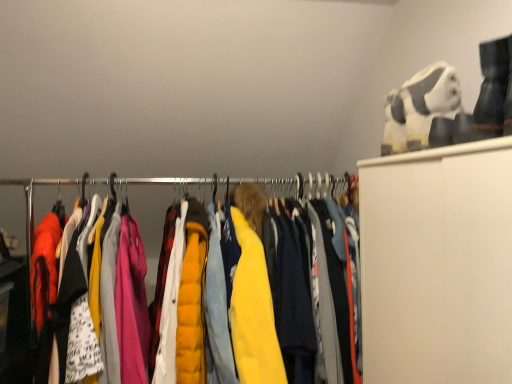
Question: Does white plush toy at upper right come behind yellow quilted jacket at center?

Choices:
 (A) no
 (B) yes

Answer: (B)

Question: Can you confirm if white plush toy at upper right is taller than yellow quilted jacket at center?

Choices:
 (A) no
 (B) yes

Answer: (A)

Question: Does white plush toy at upper right have a lesser height compared to yellow quilted jacket at center?

Choices:
 (A) yes
 (B) no

Answer: (A)

Question: Is white plush toy at upper right closer to camera compared to yellow quilted jacket at center?

Choices:
 (A) no
 (B) yes

Answer: (A)

Question: Considering the relative sizes of white plush toy at upper right and yellow quilted jacket at center in the image provided, is white plush toy at upper right bigger than yellow quilted jacket at center?

Choices:
 (A) no
 (B) yes

Answer: (A)

Question: Considering the positions of yellow quilted jacket at center and metallic hangers at center in the image, is yellow quilted jacket at center taller or shorter than metallic hangers at center?

Choices:
 (A) tall
 (B) short

Answer: (A)

Question: Looking at the image, does yellow quilted jacket at center seem bigger or smaller compared to metallic hangers at center?

Choices:
 (A) small
 (B) big

Answer: (B)

Question: From the image's perspective, is yellow quilted jacket at center positioned above or below metallic hangers at center?

Choices:
 (A) above
 (B) below

Answer: (B)

Question: Considering the positions of yellow quilted jacket at center and metallic hangers at center in the image, is yellow quilted jacket at center wider or thinner than metallic hangers at center?

Choices:
 (A) thin
 (B) wide

Answer: (B)

Question: Is point (237, 182) closer or farther from the camera than point (439, 102)?

Choices:
 (A) farther
 (B) closer

Answer: (A)

Question: Would you say metallic hangers at center is inside or outside white plush toy at upper right?

Choices:
 (A) inside
 (B) outside

Answer: (B)

Question: In terms of height, does metallic hangers at center look taller or shorter compared to white plush toy at upper right?

Choices:
 (A) short
 (B) tall

Answer: (A)

Question: Would you say metallic hangers at center is to the left or to the right of white plush toy at upper right in the picture?

Choices:
 (A) left
 (B) right

Answer: (A)

Question: Based on their sizes in the image, would you say yellow quilted jacket at center is bigger or smaller than white plush toy at upper right?

Choices:
 (A) big
 (B) small

Answer: (A)

Question: Considering the positions of point (326, 177) and point (442, 84), is point (326, 177) closer or farther from the camera than point (442, 84)?

Choices:
 (A) farther
 (B) closer

Answer: (A)